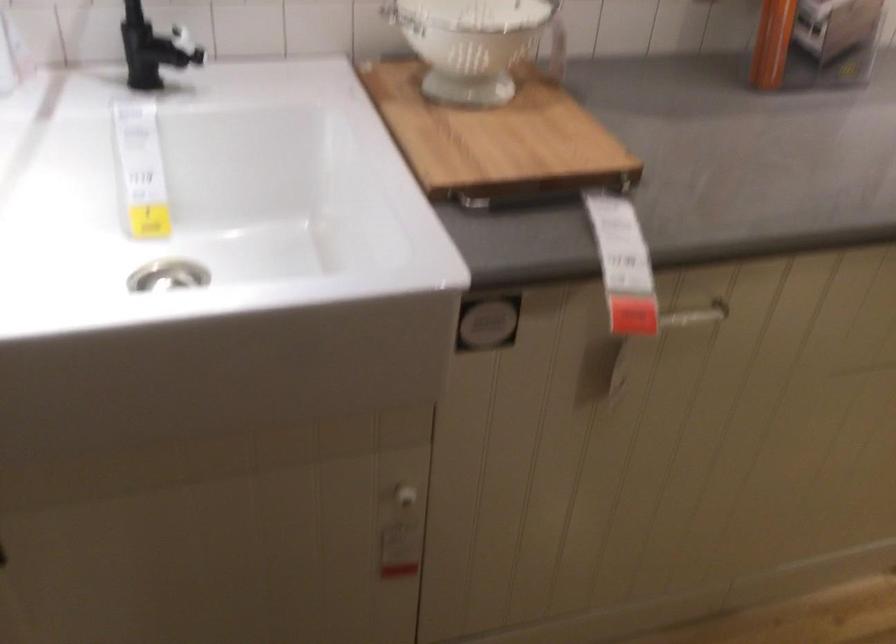
Describe the element at coordinates (695, 315) in the screenshot. The width and height of the screenshot is (896, 644). I see `the silver cabinet handle` at that location.